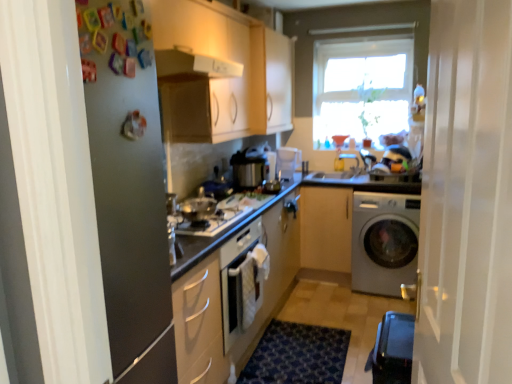
Describe the element at coordinates (215, 222) in the screenshot. This screenshot has width=512, height=384. I see `shiny silver gas stove at center` at that location.

Describe the element at coordinates (222, 72) in the screenshot. The image size is (512, 384). I see `matte white cabinet at upper left, the 3th cabinetry from the right` at that location.

Locate an element on the screen. The width and height of the screenshot is (512, 384). satin silver cooker at center, marked as the 2th appliance in a top-to-bottom arrangement is located at coordinates [x=198, y=208].

Locate an element on the screen. The image size is (512, 384). black plastic water heater at lower right is located at coordinates (393, 349).

Is blue textured rug at lower center facing away from matte white cabinet at upper left, the 3th cabinetry from the right?

No, blue textured rug at lower center's orientation is not away from matte white cabinet at upper left, the 3th cabinetry from the right.

Is blue textured rug at lower center beside matte white cabinet at upper left, the 3th cabinetry from the right?

No, blue textured rug at lower center is not beside matte white cabinet at upper left, the 3th cabinetry from the right.

Can matte white cabinet at upper left, the 3th cabinetry from the right, be found inside blue textured rug at lower center?

No, matte white cabinet at upper left, the 3th cabinetry from the right, is not surrounded by blue textured rug at lower center.

Which of these two, blue textured rug at lower center or matte white cabinet at upper left, positioned as the 1th cabinetry in left-to-right order, is bigger?

matte white cabinet at upper left, positioned as the 1th cabinetry in left-to-right order, is bigger.

Between smooth granite countertop at center and transparent glass window at upper center, which one appears on the left side from the viewer's perspective?

smooth granite countertop at center is more to the left.

From a real-world perspective, is smooth granite countertop at center positioned under transparent glass window at upper center based on gravity?

Yes.

Would you say smooth granite countertop at center contains transparent glass window at upper center?

No, transparent glass window at upper center is not surrounded by smooth granite countertop at center.

From a real-world perspective, is black plastic water heater at lower right positioned above or below smooth granite countertop at center?

black plastic water heater at lower right is situated lower than smooth granite countertop at center in the real world.

Is black plastic water heater at lower right positioned with its back to smooth granite countertop at center?

No, black plastic water heater at lower right is not facing the opposite direction of smooth granite countertop at center.

Consider the image. Is black plastic water heater at lower right next to smooth granite countertop at center and touching it?

No, black plastic water heater at lower right is not touching smooth granite countertop at center.

Considering the points (388, 346) and (390, 188), which point is behind, point (388, 346) or point (390, 188)?

The point (390, 188) is more distant.

Who is taller, smooth granite countertop at center or matte white container at center, the 1th appliance in the back-to-front sequence?

matte white container at center, the 1th appliance in the back-to-front sequence.

Considering the relative sizes of smooth granite countertop at center and matte white container at center, positioned as the 1th appliance in right-to-left order, in the image provided, is smooth granite countertop at center bigger than matte white container at center, positioned as the 1th appliance in right-to-left order,?

Yes, smooth granite countertop at center is bigger than matte white container at center, positioned as the 1th appliance in right-to-left order.

From a real-world perspective, which object rests below the other?

In real-world perspective, smooth granite countertop at center is lower.

Is matte white container at center, which ranks as the second appliance in front-to-back order, surrounded by smooth granite countertop at center?

No, matte white container at center, which ranks as the second appliance in front-to-back order, is not surrounded by smooth granite countertop at center.

From the image's perspective, relative to smooth granite countertop at center, is white glossy exhaust hood at upper center above or below?

From the image's perspective, white glossy exhaust hood at upper center appears above smooth granite countertop at center.

Which of these two, white glossy exhaust hood at upper center or smooth granite countertop at center, stands taller?

smooth granite countertop at center.

In the scene shown: In the image, is white glossy exhaust hood at upper center positioned in front of or behind smooth granite countertop at center?

Visually, white glossy exhaust hood at upper center is located in front of smooth granite countertop at center.

How many degrees apart are the facing directions of white glossy exhaust hood at upper center and smooth granite countertop at center?

The angle between the facing direction of white glossy exhaust hood at upper center and the facing direction of smooth granite countertop at center is 90 degrees.

Which of these two, matte white container at center, acting as the 2th appliance starting from the left, or white glossy refrigerator at left, which is the second screen door from right to left, stands shorter?

matte white container at center, acting as the 2th appliance starting from the left, is shorter.

Are matte white container at center, acting as the 2th appliance starting from the left, and white glossy refrigerator at left, placed as the first screen door when sorted from left to right, beside each other?

No, matte white container at center, acting as the 2th appliance starting from the left, is not making contact with white glossy refrigerator at left, placed as the first screen door when sorted from left to right.

Is white glossy refrigerator at left, placed as the first screen door when sorted from left to right, at the back of matte white container at center, the 1th appliance viewed from the top?

matte white container at center, the 1th appliance viewed from the top, does not have its back to white glossy refrigerator at left, placed as the first screen door when sorted from left to right.

Is light wood cabinet at center, which is the first cabinetry in right-to-left order, aimed at white translucent screen door at right, which appears as the 2th screen door when viewed from the left?

Yes, light wood cabinet at center, which is the first cabinetry in right-to-left order, is aimed at white translucent screen door at right, which appears as the 2th screen door when viewed from the left.

Is light wood cabinet at center, which is the first cabinetry in right-to-left order, inside the boundaries of white translucent screen door at right, marked as the first screen door in a right-to-left arrangement, or outside?

light wood cabinet at center, which is the first cabinetry in right-to-left order, is not inside white translucent screen door at right, marked as the first screen door in a right-to-left arrangement, it's outside.

Between light wood cabinet at center, which is the first cabinetry in right-to-left order, and white translucent screen door at right, which appears as the 2th screen door when viewed from the left, which one has more height?

white translucent screen door at right, which appears as the 2th screen door when viewed from the left.

Can you tell me how much light wood cabinet at center, placed as the third cabinetry when sorted from left to right, and white translucent screen door at right, which appears as the 2th screen door when viewed from the left, differ in facing direction?

They differ by 79.8 degrees in their facing directions.

Locate an element on the screen. Image resolution: width=512 pixels, height=384 pixels. doormat that appears behind the matte white cabinet at upper left, positioned as the 1th cabinetry in left-to-right order is located at coordinates (297, 355).

You are a GUI agent. You are given a task and a screenshot of the screen. Output one action in this format:
    pyautogui.click(x=<x>, y=<y>)
    Task: Click on the window above the smooth granite countertop at center (from the image's perspective)
    This screenshot has width=512, height=384.
    Given the screenshot: What is the action you would take?
    pyautogui.click(x=362, y=86)

When comparing their distances from matte wood cabinet at upper center, the 2th cabinetry positioned from the left, does matte white container at center, the second appliance when ordered from bottom to top, or white glossy refrigerator at left, which is the second screen door from right to left, seem further?

Based on the image, white glossy refrigerator at left, which is the second screen door from right to left, appears to be further to matte wood cabinet at upper center, the 2th cabinetry positioned from the left.

When comparing their distances from matte wood cabinet at upper center, the 2th cabinetry positioned from the left, does blue textured rug at lower center or transparent glass window at upper center seem closer?

transparent glass window at upper center.

Looking at this image, looking at the image, which one is located further to blue textured rug at lower center, shiny silver gas stove at center or satin silver washing machine at lower right?

shiny silver gas stove at center is further to blue textured rug at lower center.

From the image, which object appears to be farther from white glossy refrigerator at left, placed as the first screen door when sorted from left to right, shiny silver gas stove at center or white glossy exhaust hood at upper center?

white glossy exhaust hood at upper center lies further to white glossy refrigerator at left, placed as the first screen door when sorted from left to right, than the other object.

Which object lies further to the anchor point shiny silver gas stove at center, smooth granite countertop at center or white glossy exhaust hood at upper center?

smooth granite countertop at center is positioned further to the anchor shiny silver gas stove at center.

From the image, which object appears to be nearer to matte white cabinet at upper left, positioned as the 1th cabinetry in left-to-right order, satin silver washing machine at lower right or light wood cabinet at center, placed as the third cabinetry when sorted from left to right?

Among the two, light wood cabinet at center, placed as the third cabinetry when sorted from left to right, is located nearer to matte white cabinet at upper left, positioned as the 1th cabinetry in left-to-right order.

From the image, which object appears to be nearer to blue textured rug at lower center, black plastic water heater at lower right or matte wood cabinet at upper center, which is the 2th cabinetry in right-to-left order?

The object closer to blue textured rug at lower center is black plastic water heater at lower right.

From the image, which object appears to be nearer to white glossy refrigerator at left, which is the second screen door from right to left, matte white cabinet at upper left, the 3th cabinetry from the right, or satin silver washing machine at lower right?

matte white cabinet at upper left, the 3th cabinetry from the right, is closer to white glossy refrigerator at left, which is the second screen door from right to left.

Identify the location of water heater located between white glossy refrigerator at left, placed as the first screen door when sorted from left to right, and smooth granite countertop at center in the depth direction. This screenshot has width=512, height=384. (393, 349).

Find the location of `gas stove between black plastic water heater at lower right and transparent glass window at upper center from front to back`. gas stove between black plastic water heater at lower right and transparent glass window at upper center from front to back is located at coordinates (215, 222).

Identify the location of appliance positioned between matte white cabinet at upper left, the 3th cabinetry from the right, and light wood cabinet at center, which is the first cabinetry in right-to-left order, from near to far. The height and width of the screenshot is (384, 512). (198, 208).

In order to click on cabinetry positioned between white translucent screen door at right, marked as the first screen door in a right-to-left arrangement, and shiny silver gas stove at center from near to far in this screenshot , I will do `click(222, 72)`.